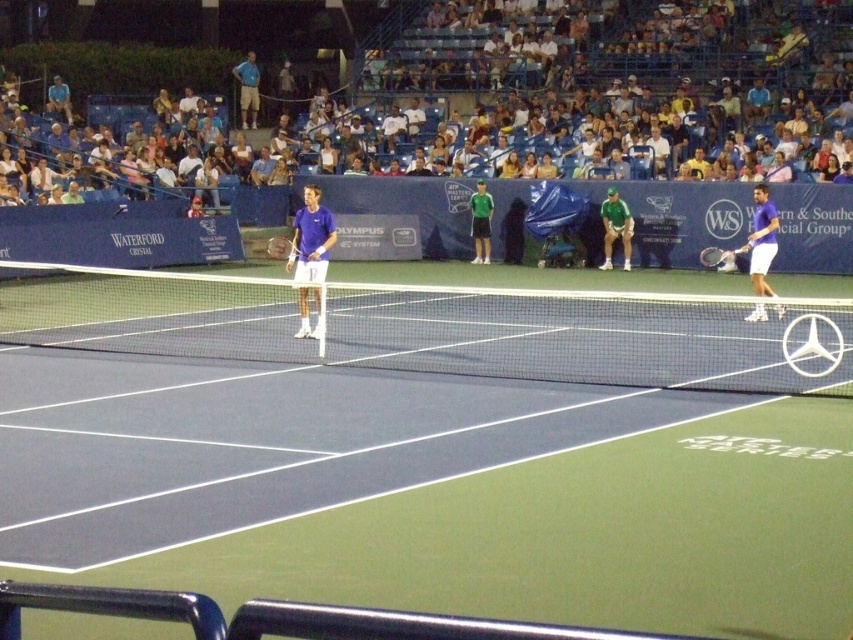
Does white cotton shirt at upper center have a lesser height compared to purple fabric tennis racket at center?

No, white cotton shirt at upper center is not shorter than purple fabric tennis racket at center.

Does white cotton shirt at upper center appear on the left side of purple fabric tennis racket at center?

In fact, white cotton shirt at upper center is to the right of purple fabric tennis racket at center.

Who is more forward, (432, 42) or (303, 216)?

Positioned in front is point (303, 216).

Image resolution: width=853 pixels, height=640 pixels. I want to click on white cotton shirt at upper center, so pyautogui.click(x=614, y=49).

Is white mesh net at center smaller than white cotton shirt at upper center?

Indeed, white mesh net at center has a smaller size compared to white cotton shirt at upper center.

Who is positioned more to the right, white mesh net at center or white cotton shirt at upper center?

From the viewer's perspective, white cotton shirt at upper center appears more on the right side.

Does point (734, 369) lie in front of point (827, 44)?

Yes, it is.

Where is `white mesh net at center`? The height and width of the screenshot is (640, 853). white mesh net at center is located at coordinates (439, 328).

Can you confirm if blue synthetic surface at center is wider than purple matte tennis racket at right?

Correct, the width of blue synthetic surface at center exceeds that of purple matte tennis racket at right.

Between point (431, 307) and point (751, 243), which one is positioned behind?

The point (751, 243) is behind.

Between point (733, 368) and point (755, 260), which one is positioned behind?

Point (755, 260)

This screenshot has height=640, width=853. In order to click on blue synthetic surface at center in this screenshot , I will do `click(421, 474)`.